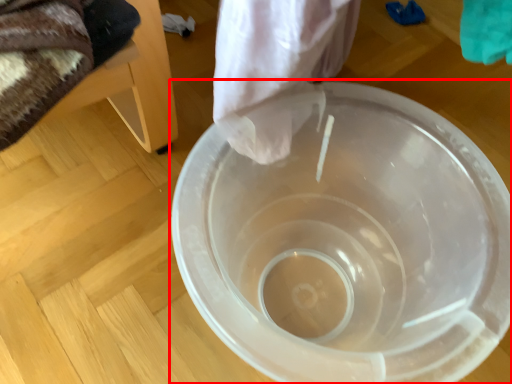
Question: Considering the relative positions of toilet (annotated by the red box) and furniture in the image provided, where is toilet (annotated by the red box) located with respect to the staircase?

Choices:
 (A) right
 (B) left

Answer: (A)